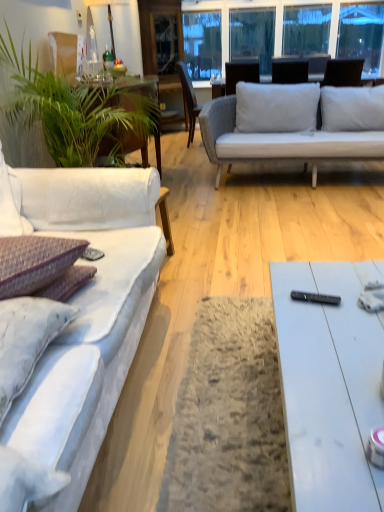
Question: Considering the relative positions of transparent glass window screen at upper center and light brown wooden chair at center in the image provided, is transparent glass window screen at upper center to the left or to the right of light brown wooden chair at center?

Choices:
 (A) right
 (B) left

Answer: (A)

Question: From the image's perspective, is transparent glass window screen at upper center positioned above or below light brown wooden chair at center?

Choices:
 (A) above
 (B) below

Answer: (A)

Question: Considering the real-world distances, which object is farthest from the light brown wooden chair at center?

Choices:
 (A) white glossy coffee table at lower right
 (B) purple textured pillow at left
 (C) green leafy plant at left
 (D) transparent glass window screen at upper center
 (E) black plastic remote control at center

Answer: (E)

Question: Which of these objects is positioned farthest from the purple textured pillow at left?

Choices:
 (A) green leafy plant at left
 (B) transparent glass window screen at upper center
 (C) white glossy coffee table at lower right
 (D) light brown wooden chair at center
 (E) black plastic remote control at center

Answer: (B)